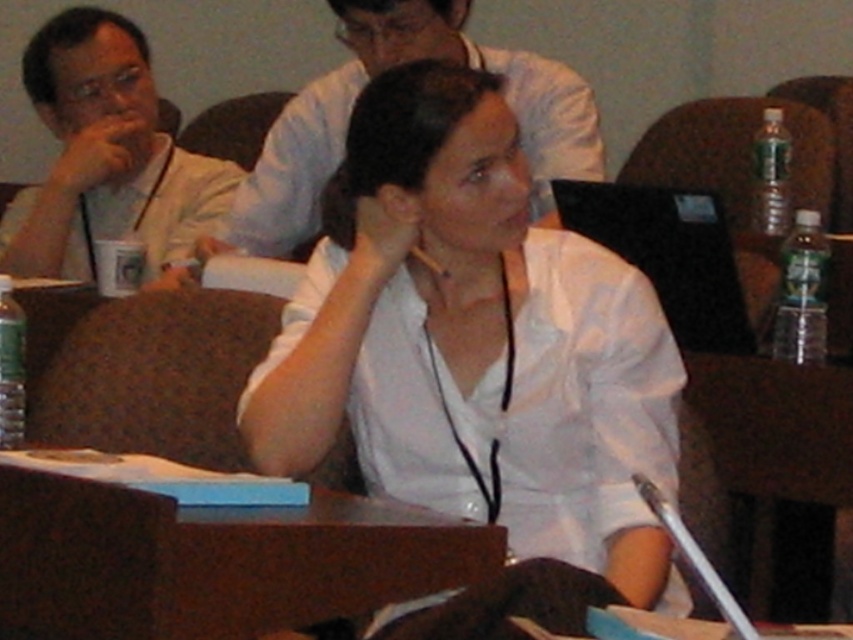
Question: Can you confirm if white matte shirt at center is smaller than white shirt at upper center?

Choices:
 (A) yes
 (B) no

Answer: (A)

Question: Which of these objects is positioned closest to the brown wood table at lower center?

Choices:
 (A) white shirt at upper center
 (B) white matte shirt at center

Answer: (B)

Question: Is brown wood table at lower center above matte white shirt at left?

Choices:
 (A) no
 (B) yes

Answer: (A)

Question: Is brown wood table at lower center to the right of matte white shirt at left from the viewer's perspective?

Choices:
 (A) yes
 (B) no

Answer: (A)

Question: Which object appears farthest from the camera in this image?

Choices:
 (A) matte white shirt at left
 (B) white matte shirt at center

Answer: (A)

Question: Which object appears closest to the camera in this image?

Choices:
 (A) matte white shirt at left
 (B) white matte shirt at center

Answer: (B)